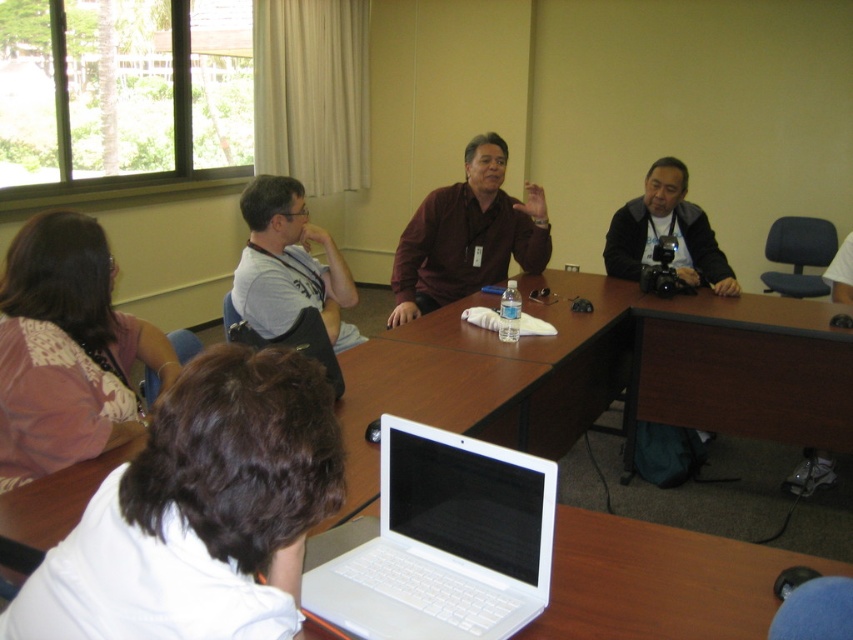
Question: Estimate the real-world distances between objects in this image. Which object is farther from the white matte t-shirt at center?

Choices:
 (A) white matte shirt at lower left
 (B) black matte camera at right
 (C) matte brown shirt at center

Answer: (B)

Question: Is the position of white plastic laptop at center less distant than that of white matte t-shirt at center?

Choices:
 (A) no
 (B) yes

Answer: (B)

Question: Can you confirm if matte brown shirt at center is wider than white matte t-shirt at center?

Choices:
 (A) yes
 (B) no

Answer: (A)

Question: Which point is closer to the camera?

Choices:
 (A) matte brown shirt at center
 (B) white matte t-shirt at center
 (C) pink floral blouse at lower left

Answer: (C)

Question: Is white matte shirt at lower left to the left of pink floral blouse at lower left from the viewer's perspective?

Choices:
 (A) no
 (B) yes

Answer: (A)

Question: Among these points, which one is nearest to the camera?

Choices:
 (A) (480, 260)
 (B) (428, 572)
 (C) (61, 256)

Answer: (B)